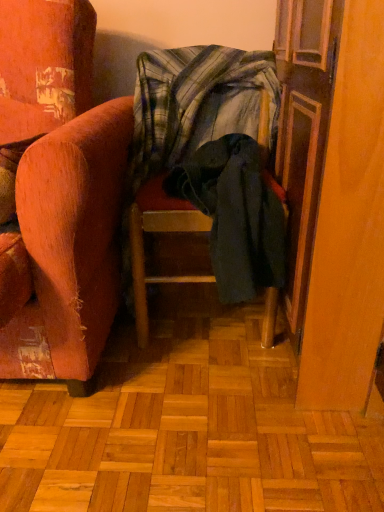
Identify the location of wooden screen door at right. [349, 226].

What do you see at coordinates (349, 226) in the screenshot? I see `wooden screen door at right` at bounding box center [349, 226].

From the picture: What is the approximate width of plaid fabric blanket at center?

Result: The width of plaid fabric blanket at center is 12.51 inches.

This screenshot has width=384, height=512. In order to click on dark green fabric chair at center in this screenshot , I will do `click(159, 232)`.

Is plaid fabric blanket at center far away from wooden screen door at right?

plaid fabric blanket at center is actually quite close to wooden screen door at right.

Considering the sizes of objects plaid fabric blanket at center and wooden screen door at right in the image provided, who is bigger, plaid fabric blanket at center or wooden screen door at right?

wooden screen door at right is bigger.

From a real-world perspective, between plaid fabric blanket at center and wooden screen door at right, who is vertically lower?

wooden screen door at right, from a real-world perspective.

Considering the relative positions of dark green fabric chair at center and wooden screen door at right in the image provided, is dark green fabric chair at center to the left of wooden screen door at right from the viewer's perspective?

Yes, dark green fabric chair at center is to the left of wooden screen door at right.

Could you tell me if dark green fabric chair at center is turned towards wooden screen door at right?

No, dark green fabric chair at center is not turned towards wooden screen door at right.

In the scene shown: Which of these two, dark green fabric chair at center or wooden screen door at right, is thinner?

With smaller width is dark green fabric chair at center.

Are dark green fabric chair at center and wooden screen door at right making contact?

dark green fabric chair at center and wooden screen door at right are not in contact.

Is dark green fabric chair at center surrounded by plaid fabric blanket at center?

No, plaid fabric blanket at center does not contain dark green fabric chair at center.

From the image's perspective, is plaid fabric blanket at center over dark green fabric chair at center?

Yes.

In terms of height, does plaid fabric blanket at center look taller or shorter compared to dark green fabric chair at center?

In the image, plaid fabric blanket at center appears to be shorter than dark green fabric chair at center.

Is point (327, 220) closer or farther from the camera than point (181, 82)?

Point (327, 220) appears to be closer to the viewer than point (181, 82).

Is wooden screen door at right not near plaid fabric blanket at center?

Actually, wooden screen door at right and plaid fabric blanket at center are a little close together.

Considering the relative positions of wooden screen door at right and plaid fabric blanket at center in the image provided, is wooden screen door at right to the left of plaid fabric blanket at center from the viewer's perspective?

Incorrect, wooden screen door at right is not on the left side of plaid fabric blanket at center.

From a real-world perspective, is wooden screen door at right located beneath plaid fabric blanket at center?

Indeed, from a real-world perspective, wooden screen door at right is positioned beneath plaid fabric blanket at center.

How distant is wooden screen door at right from dark green fabric chair at center?

wooden screen door at right is 14.58 inches from dark green fabric chair at center.

From a real-world perspective, which object stands above the other?

In real-world perspective, wooden screen door at right is above.

Can you confirm if wooden screen door at right is wider than dark green fabric chair at center?

Correct, the width of wooden screen door at right exceeds that of dark green fabric chair at center.

Is plaid fabric blanket at center a part of dark green fabric chair at center?

No, plaid fabric blanket at center is not surrounded by dark green fabric chair at center.

Is dark green fabric chair at center next to plaid fabric blanket at center?

No, dark green fabric chair at center is not making contact with plaid fabric blanket at center.

Which object is thinner, dark green fabric chair at center or plaid fabric blanket at center?

Thinner between the two is plaid fabric blanket at center.

Locate an element on the screen. The image size is (384, 512). screen door below the plaid fabric blanket at center (from a real-world perspective) is located at coordinates (349, 226).

Where is `screen door above the dark green fabric chair at center (from the image's perspective)`? screen door above the dark green fabric chair at center (from the image's perspective) is located at coordinates (349, 226).

Consider the image. Considering their positions, is wooden screen door at right positioned closer to dark green fabric chair at center than plaid fabric blanket at center?

plaid fabric blanket at center.

Which object lies further to the anchor point wooden screen door at right, plaid fabric blanket at center or dark green fabric chair at center?

Among the two, plaid fabric blanket at center is located further to wooden screen door at right.

Estimate the real-world distances between objects in this image. Which object is further from dark green fabric chair at center, plaid fabric blanket at center or wooden screen door at right?

Based on the image, wooden screen door at right appears to be further to dark green fabric chair at center.

Considering their positions, is wooden screen door at right positioned further to plaid fabric blanket at center than dark green fabric chair at center?

wooden screen door at right.

When comparing their distances from plaid fabric blanket at center, does dark green fabric chair at center or wooden screen door at right seem further?

wooden screen door at right is further to plaid fabric blanket at center.

Which object lies nearer to the anchor point wooden screen door at right, dark green fabric chair at center or plaid fabric blanket at center?

dark green fabric chair at center.

Locate an element on the screen. The width and height of the screenshot is (384, 512). furniture situated between plaid fabric blanket at center and wooden screen door at right from left to right is located at coordinates (159, 232).